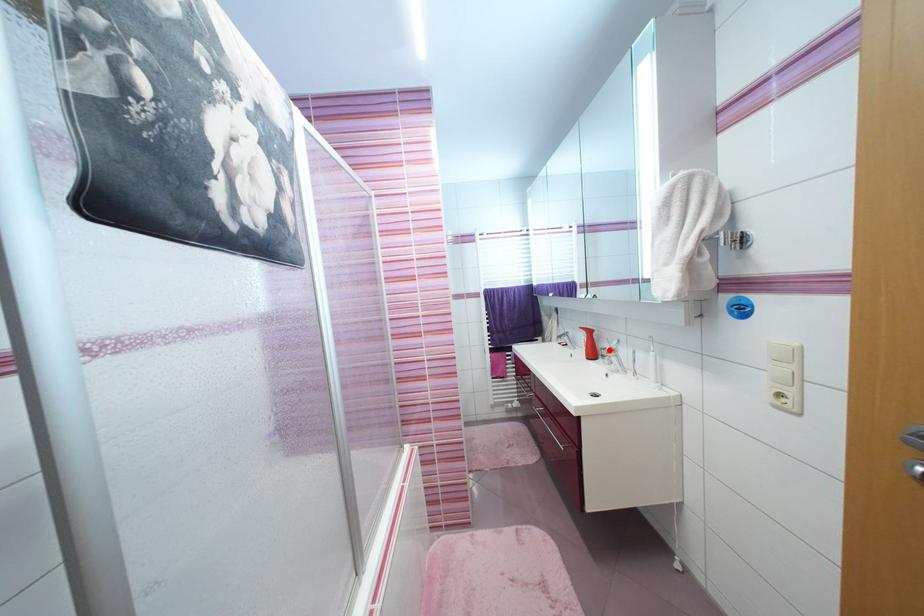
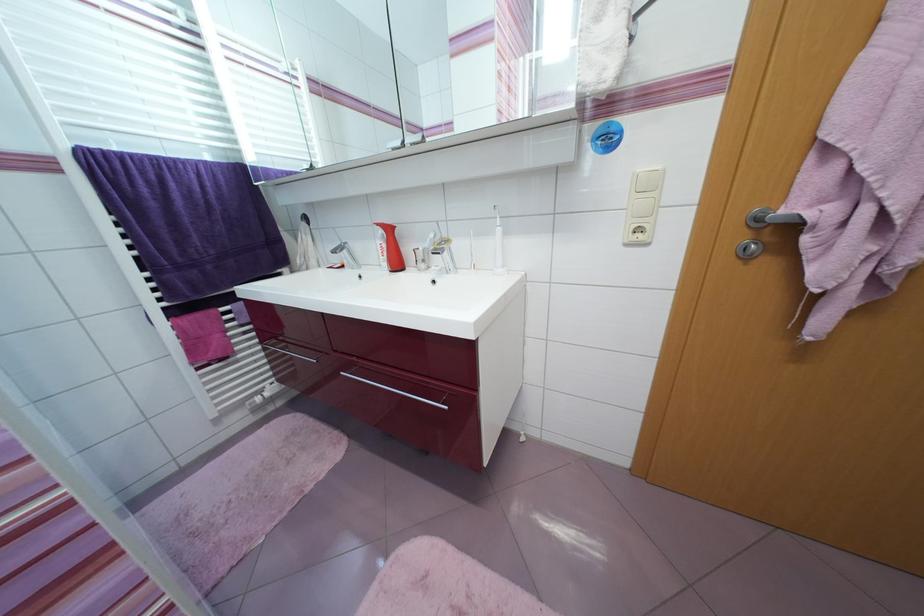
Question: I am providing you with two images of the same scene from different viewpoints. A red point is shown in image1. For the corresponding object point in image2, is it positioned nearer or farther from the camera?

Choices:
 (A) Nearer
 (B) Farther

Answer: (A)